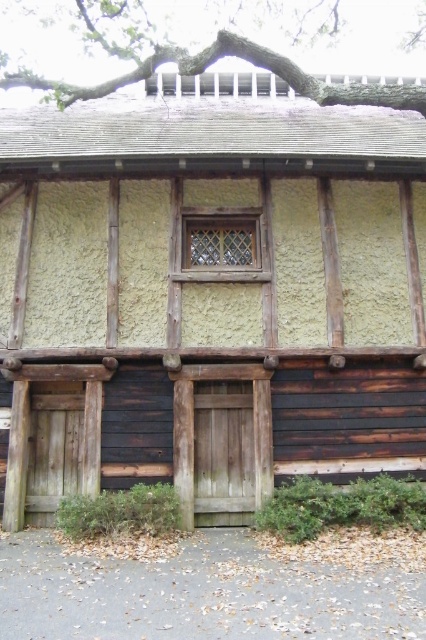
Question: Is rough plaster wall at center above matte wooden window at center?

Choices:
 (A) no
 (B) yes

Answer: (B)

Question: Observing the image, what is the correct spatial positioning of rough plaster wall at center in reference to matte wooden window at center?

Choices:
 (A) left
 (B) right

Answer: (B)

Question: Which point is farther to the camera?

Choices:
 (A) rough plaster wall at center
 (B) matte wooden window at center

Answer: (B)

Question: Which of the following is the farthest from the observer?

Choices:
 (A) (196, 246)
 (B) (261, 205)

Answer: (A)

Question: Does rough plaster wall at center have a larger size compared to matte wooden window at center?

Choices:
 (A) yes
 (B) no

Answer: (A)